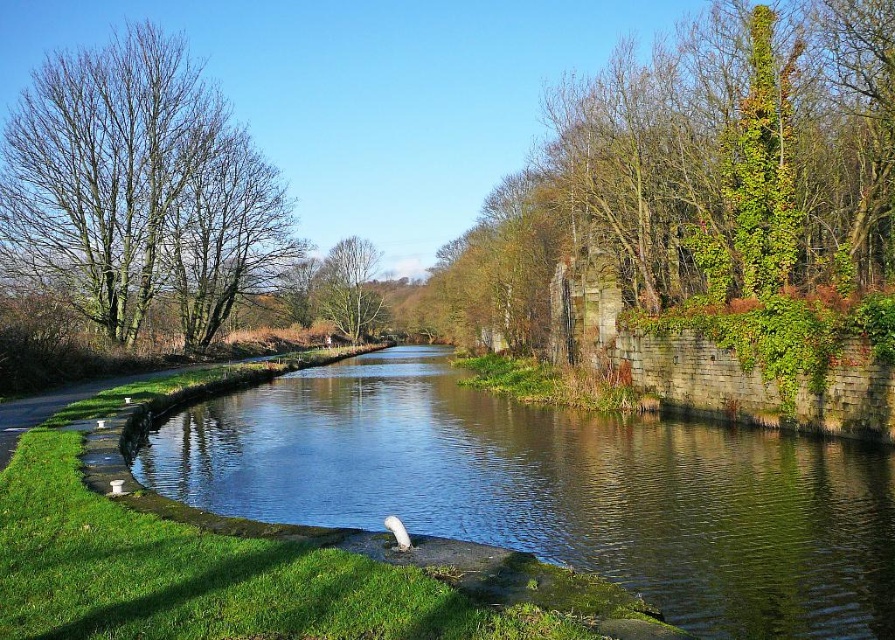
You are standing on the paved path next to the canal and want to take a photo of the green leafy tree at left. If your camera has a maximum zoom range of 100 feet, will you be able to get a clear, zoomed shot of the tree without moving closer?

The green leafy tree at left is 133.95 feet away from the viewer. Since the camera can only zoom up to 100 feet, you won

You are a photographer planning to capture the canal scene. You want to ensure both the green stone river at center and the green leafy tree at left are visible in your shot. Which object will occupy a larger portion of the photo?

The green leafy tree at left occupies more space than the green stone river at center in the image, so it will take up a larger portion of the photo.

You are standing on the grassy embankment and want to cross to the other side of the canal. The green leafy tree at center is blocking your view. Can you see the green stone river at center from your current position?

The green stone river at center is positioned under the green leafy tree at center, so yes, you can see the green stone river at center because it is located beneath the tree.